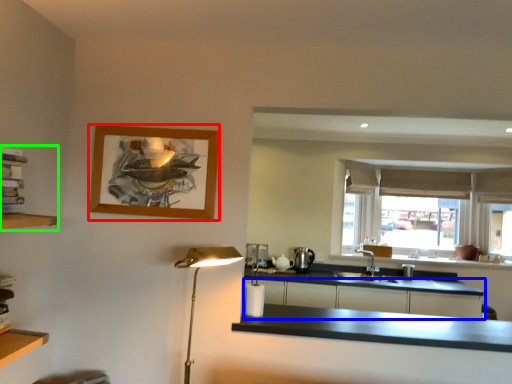
Question: Considering the real-world distances, which object is farthest from picture frame (highlighted by a red box)? cabinetry (highlighted by a blue box) or shelf (highlighted by a green box)?

Choices:
 (A) cabinetry
 (B) shelf

Answer: (A)